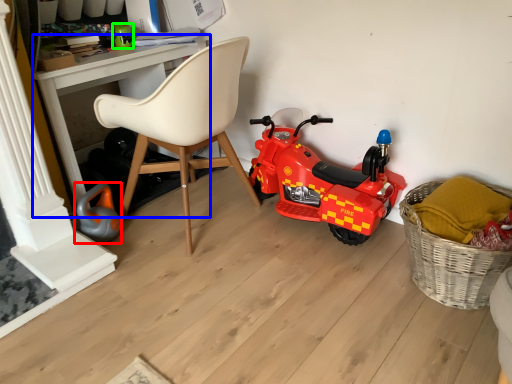
Question: Which object is the closest to the toy (highlighted by a red box)? Choose among these: desk (highlighted by a blue box) or toy (highlighted by a green box).

Choices:
 (A) desk
 (B) toy

Answer: (A)